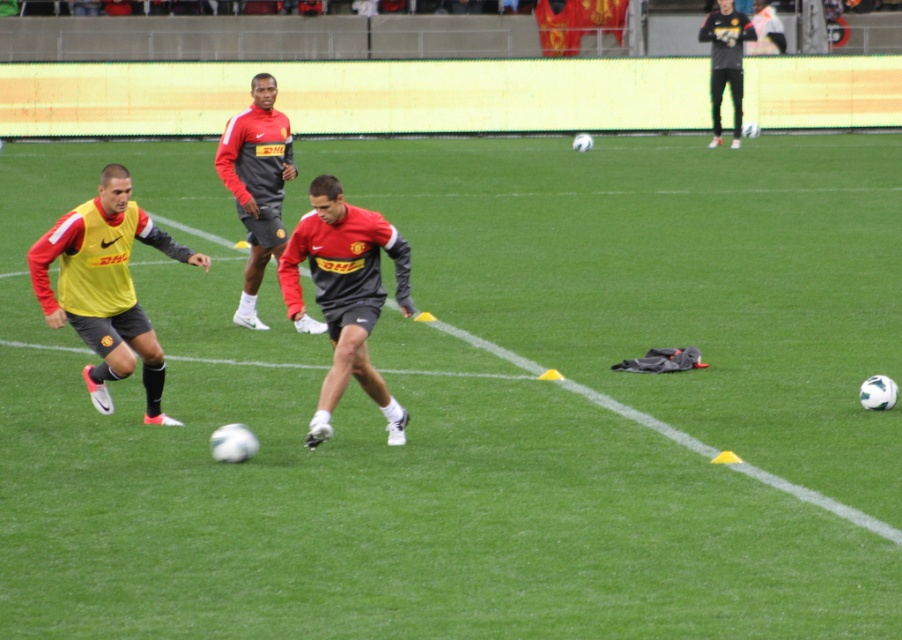
Can you confirm if yellow matte jersey at left is shorter than black matte pants at upper right?

Yes.

The height and width of the screenshot is (640, 902). Find the location of `yellow matte jersey at left`. yellow matte jersey at left is located at coordinates (106, 288).

The image size is (902, 640). What do you see at coordinates (106, 288) in the screenshot?
I see `yellow matte jersey at left` at bounding box center [106, 288].

What do you see at coordinates (106, 288) in the screenshot? I see `yellow matte jersey at left` at bounding box center [106, 288].

Find the location of a particular element. The width and height of the screenshot is (902, 640). yellow matte jersey at left is located at coordinates (106, 288).

Is yellow matte jersey at left to the left of matte red shirt at center from the viewer's perspective?

Correct, you'll find yellow matte jersey at left to the left of matte red shirt at center.

Looking at this image, between yellow matte jersey at left and matte red shirt at center, which one has more height?

With more height is matte red shirt at center.

Describe the element at coordinates (106, 288) in the screenshot. Image resolution: width=902 pixels, height=640 pixels. I see `yellow matte jersey at left` at that location.

Where is `yellow matte jersey at left`? The image size is (902, 640). yellow matte jersey at left is located at coordinates (106, 288).